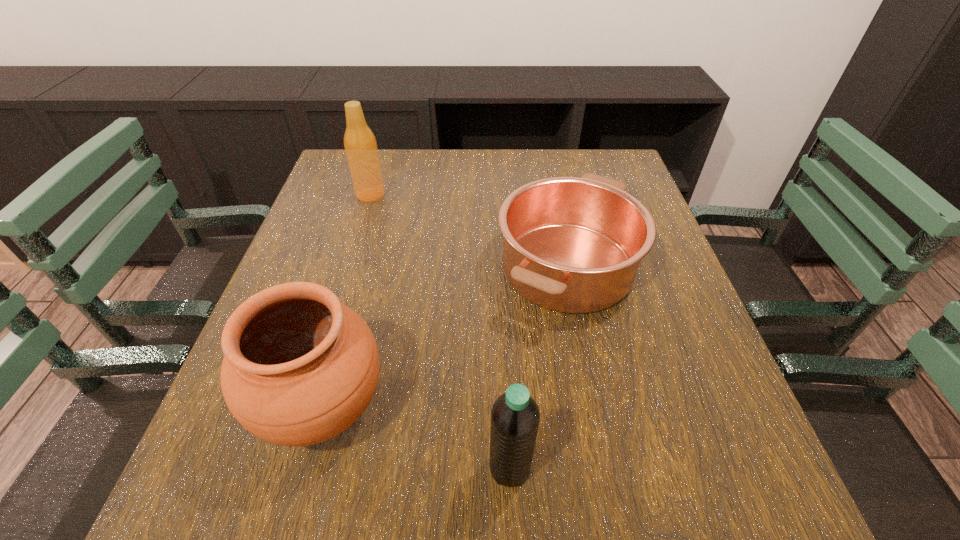
The width and height of the screenshot is (960, 540). In order to click on pottery positioned at the near edge in this screenshot , I will do `click(299, 367)`.

Where is `water bottle that is at the near edge`? Image resolution: width=960 pixels, height=540 pixels. water bottle that is at the near edge is located at coordinates (515, 416).

Where is `beer bottle that is at the left edge`? beer bottle that is at the left edge is located at coordinates (360, 144).

You are a GUI agent. You are given a task and a screenshot of the screen. Output one action in this format:
    pyautogui.click(x=<x>, y=<y>)
    Task: Click on the pottery located in the left edge section of the desktop
    
    Given the screenshot: What is the action you would take?
    pyautogui.click(x=299, y=367)

The image size is (960, 540). I want to click on object at the right edge, so coord(574,245).

Where is `object positioned at the far left corner`? This screenshot has width=960, height=540. object positioned at the far left corner is located at coordinates (360, 144).

Image resolution: width=960 pixels, height=540 pixels. Find the location of `object that is at the near left corner`. object that is at the near left corner is located at coordinates (299, 367).

Image resolution: width=960 pixels, height=540 pixels. What are the coordinates of `vacant region at the far edge` in the screenshot? It's located at (433, 183).

Image resolution: width=960 pixels, height=540 pixels. I want to click on free space at the near edge of the desktop, so click(388, 497).

The image size is (960, 540). In the image, there is a desktop. In order to click on free region at the left edge in this screenshot , I will do `click(328, 265)`.